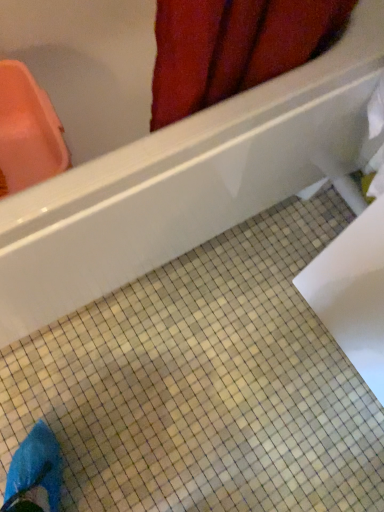
Question: Can you confirm if white glossy ceramic tile at center is taller than white glossy bathtub at upper center?

Choices:
 (A) yes
 (B) no

Answer: (B)

Question: Could you tell me if white glossy ceramic tile at center is facing white glossy bathtub at upper center?

Choices:
 (A) no
 (B) yes

Answer: (A)

Question: Can you confirm if white glossy ceramic tile at center is bigger than white glossy bathtub at upper center?

Choices:
 (A) yes
 (B) no

Answer: (B)

Question: From the image's perspective, is white glossy ceramic tile at center below white glossy bathtub at upper center?

Choices:
 (A) yes
 (B) no

Answer: (A)

Question: Would you say white glossy ceramic tile at center is outside white glossy bathtub at upper center?

Choices:
 (A) yes
 (B) no

Answer: (A)

Question: Is white glossy ceramic tile at center wider than white glossy bathtub at upper center?

Choices:
 (A) yes
 (B) no

Answer: (A)

Question: From a real-world perspective, is white glossy bathtub at upper center on white glossy ceramic tile at center?

Choices:
 (A) yes
 (B) no

Answer: (A)

Question: Is white glossy bathtub at upper center bigger than white glossy ceramic tile at center?

Choices:
 (A) no
 (B) yes

Answer: (B)

Question: Is white glossy bathtub at upper center positioned before white glossy ceramic tile at center?

Choices:
 (A) yes
 (B) no

Answer: (A)

Question: Is white glossy bathtub at upper center outside of white glossy ceramic tile at center?

Choices:
 (A) no
 (B) yes

Answer: (B)

Question: Does white glossy bathtub at upper center have a lesser width compared to white glossy ceramic tile at center?

Choices:
 (A) no
 (B) yes

Answer: (B)

Question: Considering the relative positions of white glossy bathtub at upper center and white glossy ceramic tile at center in the image provided, is white glossy bathtub at upper center to the right of white glossy ceramic tile at center from the viewer's perspective?

Choices:
 (A) no
 (B) yes

Answer: (A)

Question: Would you say white glossy bathtub at upper center is inside or outside white glossy ceramic tile at center?

Choices:
 (A) outside
 (B) inside

Answer: (A)